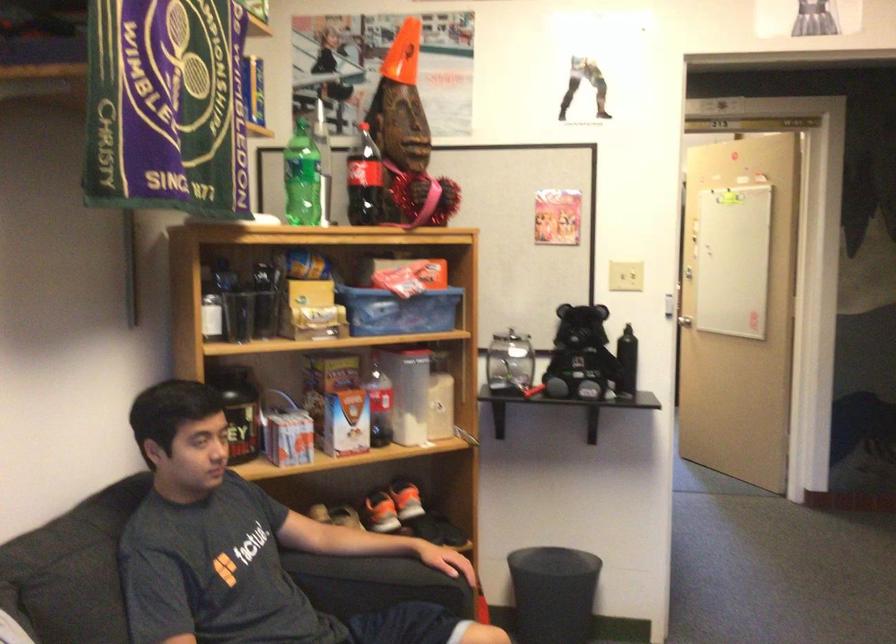
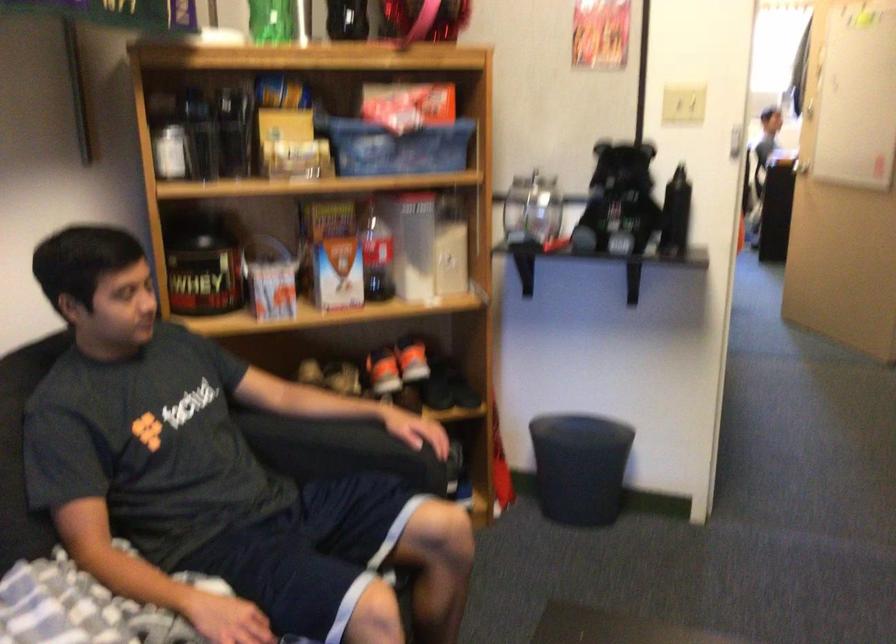
In the second image, find the point that corresponds to pixel 366 574 in the first image.

(330, 444)